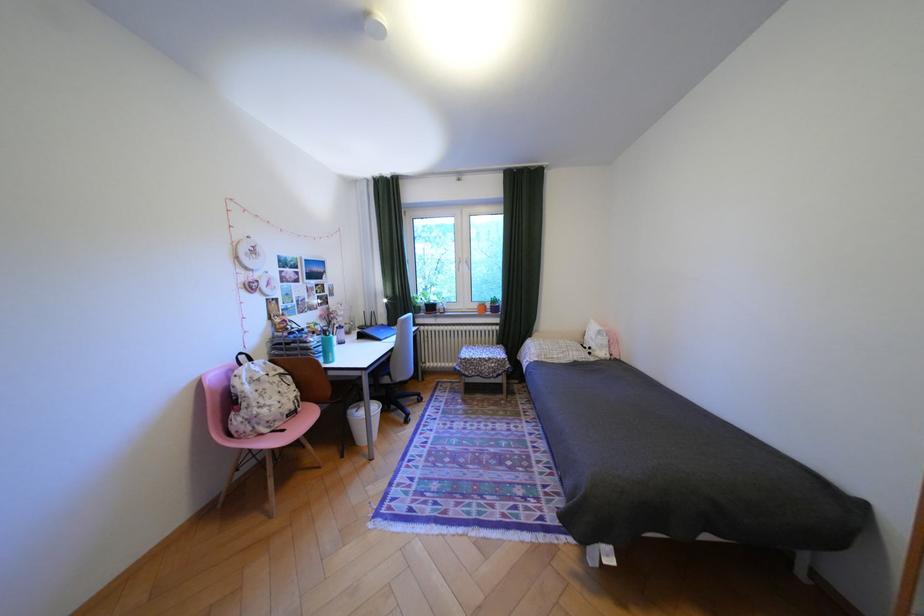
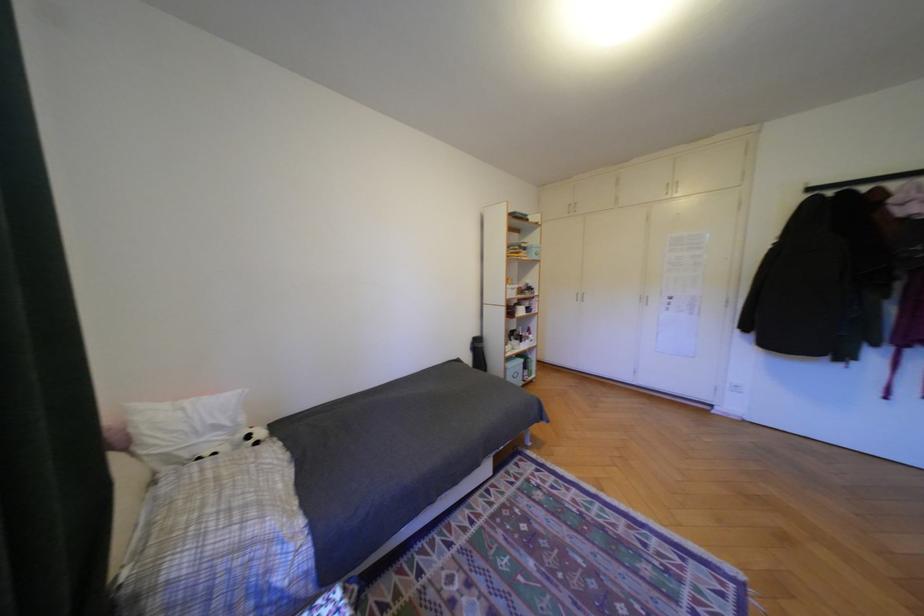
Find the pixel in the second image that matches (x=603, y=339) in the first image.

(228, 427)